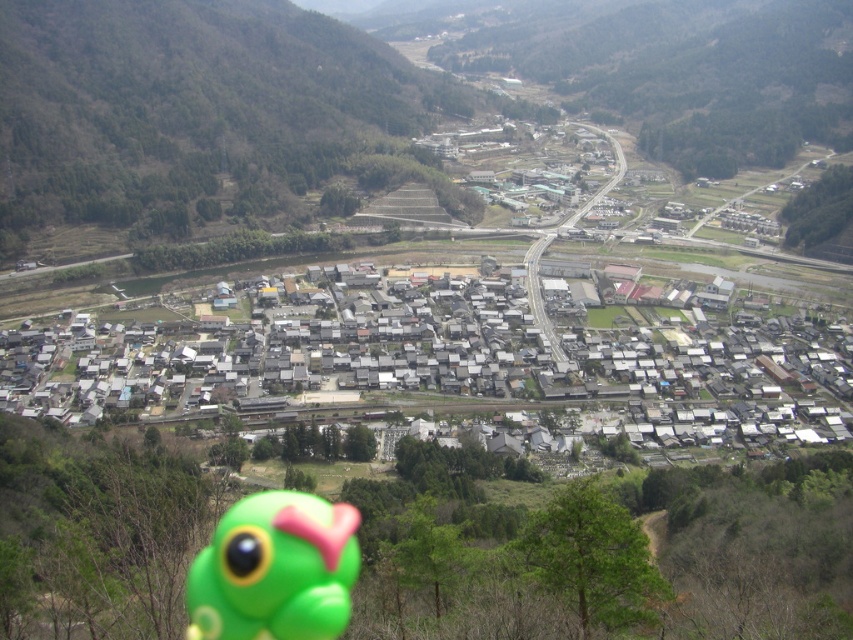
Question: Can you confirm if gray/flat-roofed houses at center is wider than green rubber toy at lower left?

Choices:
 (A) no
 (B) yes

Answer: (B)

Question: Is gray/flat-roofed houses at center smaller than green rubber toy at lower left?

Choices:
 (A) yes
 (B) no

Answer: (B)

Question: Observing the image, what is the correct spatial positioning of gray/flat-roofed houses at center in reference to green rubber toy at lower left?

Choices:
 (A) left
 (B) right

Answer: (B)

Question: Among these points, which one is farthest from the camera?

Choices:
 (A) (223, 586)
 (B) (33, 333)

Answer: (B)